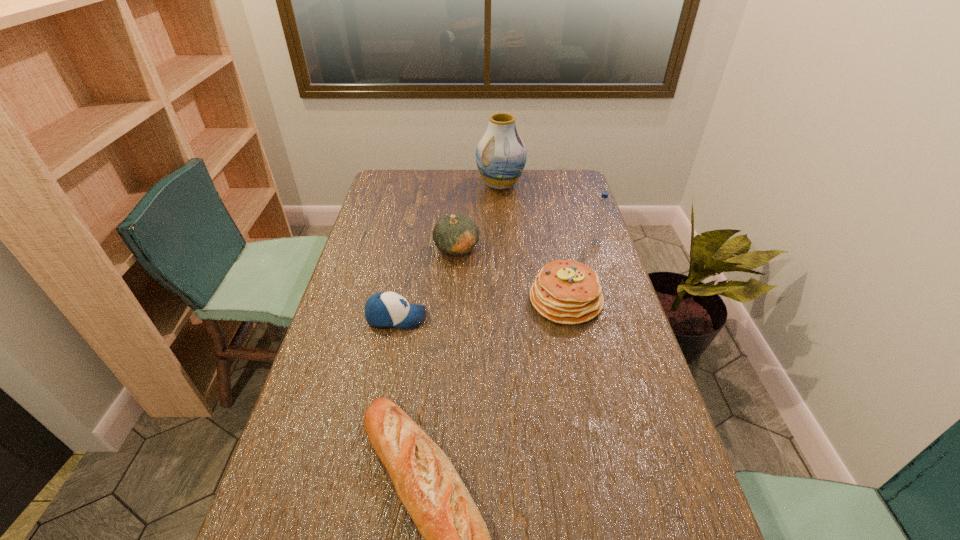
Where is `vase`? The height and width of the screenshot is (540, 960). vase is located at coordinates (501, 155).

Locate an element on the screen. This screenshot has height=540, width=960. the tallest object is located at coordinates (501, 155).

I want to click on the second tallest object, so click(x=601, y=211).

Find the location of a particular element. The image size is (960, 540). water bottle is located at coordinates (601, 211).

The height and width of the screenshot is (540, 960). I want to click on gourd, so click(458, 234).

You are a GUI agent. You are given a task and a screenshot of the screen. Output one action in this format:
    pyautogui.click(x=<x>, y=<y>)
    Task: Click on the third shortest object
    This screenshot has height=540, width=960.
    Given the screenshot: What is the action you would take?
    pyautogui.click(x=568, y=292)

Identify the location of baseball cap. The width and height of the screenshot is (960, 540). (387, 309).

The width and height of the screenshot is (960, 540). Find the location of `vacant space located 0.180m on the front of the tallest object`. vacant space located 0.180m on the front of the tallest object is located at coordinates (503, 221).

Where is `vacant area situated 0.260m on the front of the second tallest object`? vacant area situated 0.260m on the front of the second tallest object is located at coordinates (613, 295).

Where is `free region located 0.130m on the right of the gourd`? The height and width of the screenshot is (540, 960). free region located 0.130m on the right of the gourd is located at coordinates click(x=516, y=247).